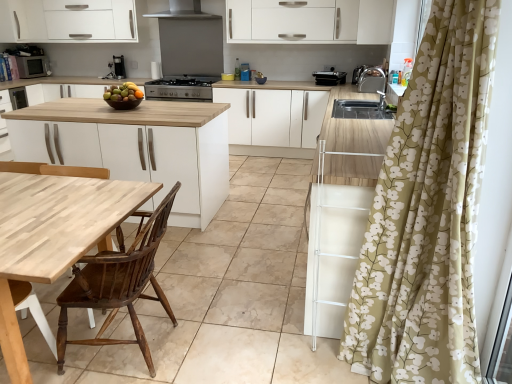
Question: Is white matte cabinet at upper left, which is the 1th cabinetry from left to right, wider than white matte cabinet at center, acting as the 3th cabinetry starting from the top?

Choices:
 (A) no
 (B) yes

Answer: (A)

Question: Is white matte cabinet at upper left, which is the 1th cabinetry from left to right, not inside white matte cabinet at center, acting as the 3th cabinetry starting from the top?

Choices:
 (A) no
 (B) yes

Answer: (B)

Question: Is white matte cabinet at upper left, which is the 1th cabinetry from left to right, further to camera compared to white matte cabinet at center, the 1th cabinetry when ordered from bottom to top?

Choices:
 (A) yes
 (B) no

Answer: (A)

Question: Does white matte cabinet at upper left, which is the third cabinetry in right-to-left order, have a lesser width compared to white matte cabinet at center, positioned as the second cabinetry in left-to-right order?

Choices:
 (A) no
 (B) yes

Answer: (B)

Question: Is white matte cabinet at upper left, which is the 1th cabinetry from left to right, to the left of white matte cabinet at center, positioned as the second cabinetry in left-to-right order, from the viewer's perspective?

Choices:
 (A) no
 (B) yes

Answer: (B)

Question: From a real-world perspective, relative to wooden chair at left, acting as the 3th chair starting from the right, is shiny brown bowl of mixed fruits at center vertically above or below?

Choices:
 (A) below
 (B) above

Answer: (B)

Question: In terms of size, does shiny brown bowl of mixed fruits at center appear bigger or smaller than wooden chair at left, acting as the 3th chair starting from the right?

Choices:
 (A) big
 (B) small

Answer: (B)

Question: Is shiny brown bowl of mixed fruits at center wider or thinner than wooden chair at left, the 1th chair positioned from the left?

Choices:
 (A) thin
 (B) wide

Answer: (A)

Question: Would you say shiny brown bowl of mixed fruits at center is to the left or to the right of wooden chair at left, the 1th chair positioned from the left, in the picture?

Choices:
 (A) right
 (B) left

Answer: (A)

Question: From a real-world perspective, is light brown wood chair at lower left, marked as the second chair in a right-to-left arrangement, physically located above or below wooden at left, which is counted as the first chair, starting from the right?

Choices:
 (A) above
 (B) below

Answer: (A)

Question: Is light brown wood chair at lower left, marked as the second chair in a right-to-left arrangement, in front of or behind wooden at left, which is counted as the 3th chair, starting from the left, in the image?

Choices:
 (A) front
 (B) behind

Answer: (A)

Question: Considering the positions of light brown wood chair at lower left, marked as the second chair in a right-to-left arrangement, and wooden at left, which is counted as the first chair, starting from the right, in the image, is light brown wood chair at lower left, marked as the second chair in a right-to-left arrangement, taller or shorter than wooden at left, which is counted as the first chair, starting from the right,?

Choices:
 (A) short
 (B) tall

Answer: (B)

Question: Is light brown wood chair at lower left, marked as the second chair in a right-to-left arrangement, to the left or to the right of wooden at left, which is counted as the 3th chair, starting from the left, in the image?

Choices:
 (A) left
 (B) right

Answer: (A)

Question: Choose the correct answer: Is wooden chair at left, the 1th chair positioned from the left, inside matte silver microwave at left, the third appliance when ordered from front to back, or outside it?

Choices:
 (A) inside
 (B) outside

Answer: (B)

Question: Is point pyautogui.click(x=142, y=240) closer or farther from the camera than point pyautogui.click(x=17, y=59)?

Choices:
 (A) farther
 (B) closer

Answer: (B)